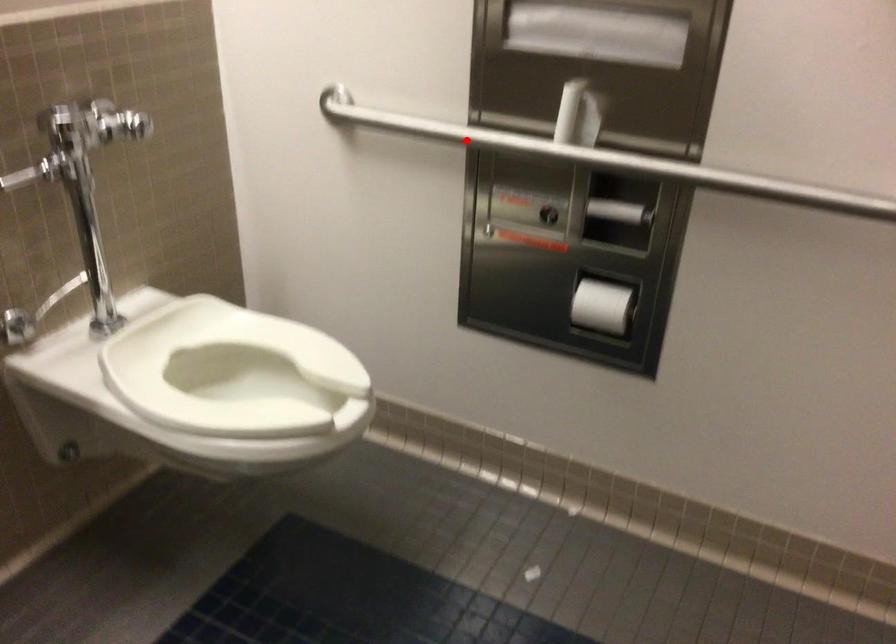
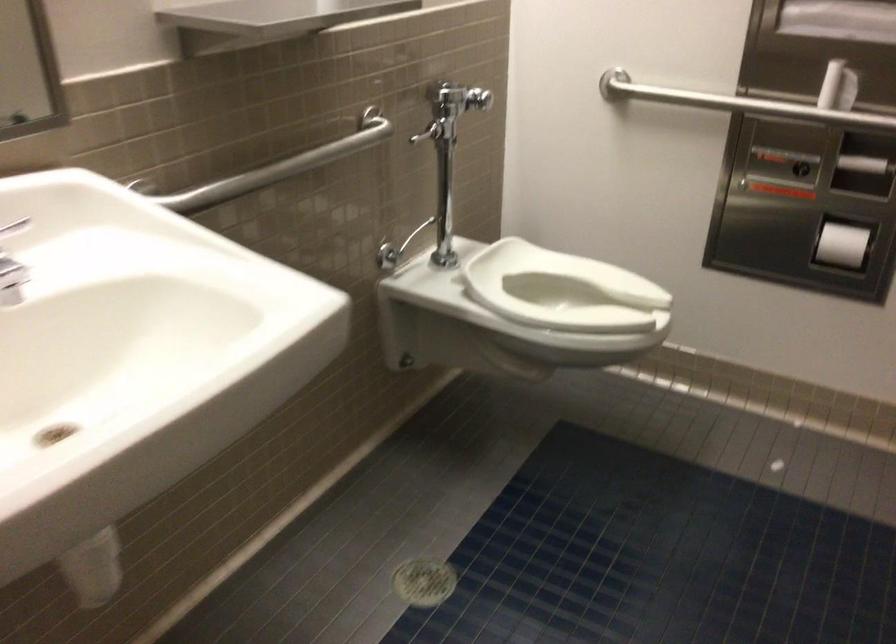
The point at the highlighted location is marked in the first image. Where is the corresponding point in the second image?

(739, 104)